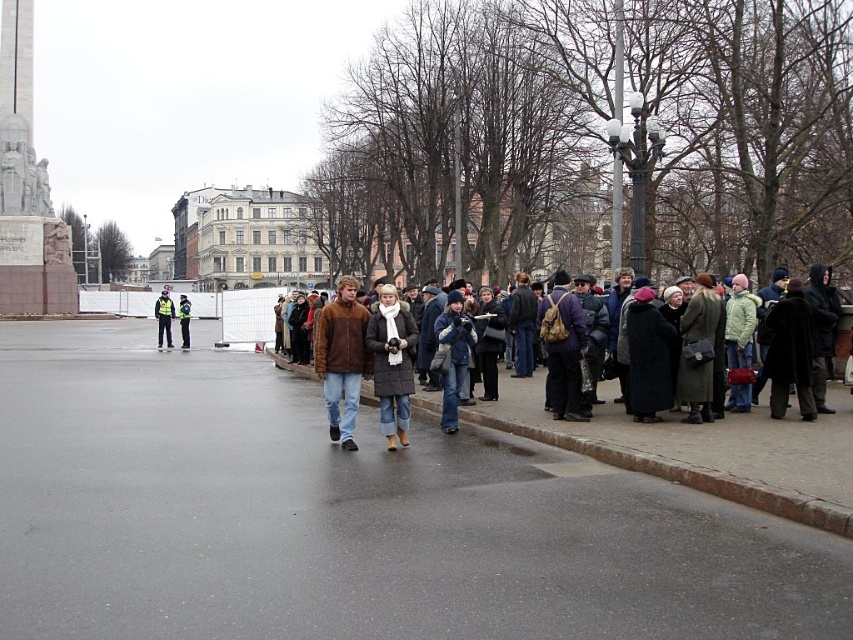
Question: Which point is farther to the camera?

Choices:
 (A) matte brown coat at center
 (B) yellow reflective jacket at center

Answer: (B)

Question: Is brown woolen coat at center thinner than denim jacket at center?

Choices:
 (A) no
 (B) yes

Answer: (A)

Question: Which point is farther from the camera taking this photo?

Choices:
 (A) (566, 416)
 (B) (166, 324)

Answer: (B)

Question: Does brown woolen coat at center appear on the right side of denim jacket at center?

Choices:
 (A) no
 (B) yes

Answer: (B)

Question: Is matte brown coat at center positioned before denim jacket at center?

Choices:
 (A) yes
 (B) no

Answer: (A)

Question: Estimate the real-world distances between objects in this image. Which object is farther from the brown fuzzy jacket at center?

Choices:
 (A) denim jacket at center
 (B) purple fabric backpack at center-right
 (C) brown woolen coat at center

Answer: (B)